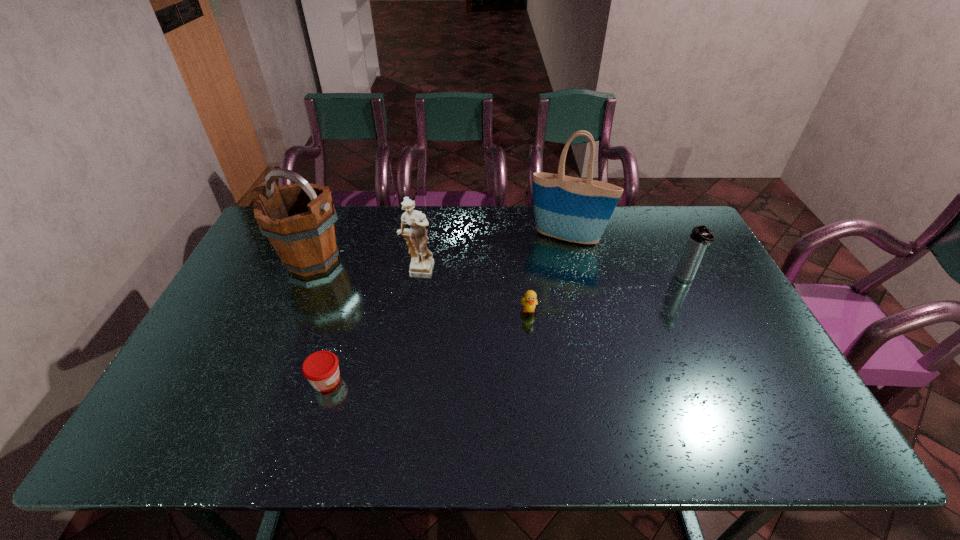
I want to click on tote bag, so click(x=577, y=210).

The height and width of the screenshot is (540, 960). I want to click on the leftmost object, so click(x=299, y=219).

Locate an element on the screen. The image size is (960, 540). figurine is located at coordinates (422, 263).

Locate an element on the screen. the third object from left to right is located at coordinates (422, 263).

I want to click on the fourth tallest object, so click(701, 236).

The image size is (960, 540). I want to click on the rightmost object, so click(x=701, y=236).

You are a GUI agent. You are given a task and a screenshot of the screen. Output one action in this format:
    pyautogui.click(x=<x>, y=<y>)
    Task: Click on the fifth farthest object
    
    Given the screenshot: What is the action you would take?
    pyautogui.click(x=529, y=302)

This screenshot has height=540, width=960. I want to click on the third object from right to left, so click(529, 302).

Image resolution: width=960 pixels, height=540 pixels. What are the coordinates of `the second object from left to right` in the screenshot? It's located at (321, 369).

I want to click on the nearest object, so click(321, 369).